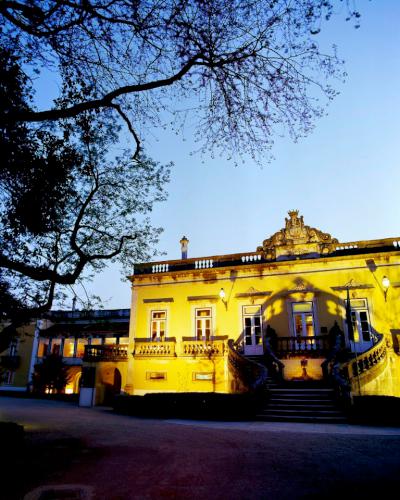
Find the location of a particular element. The height and width of the screenshot is (500, 400). 2 staircases on the right side is located at coordinates click(x=361, y=359), click(x=249, y=360).